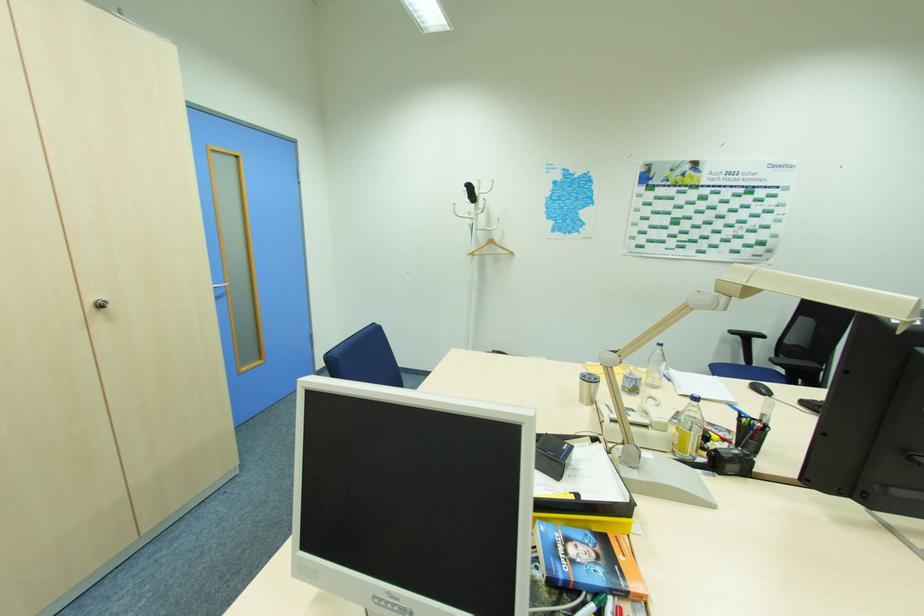
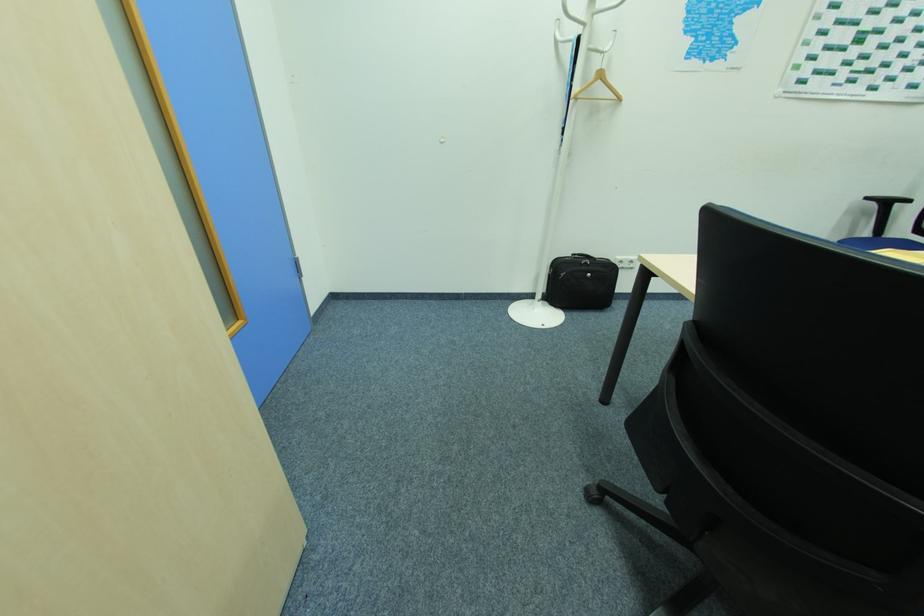
The images are taken continuously from a first-person perspective. In which direction are you moving?

The movement direction of the cameraman is left, forward.